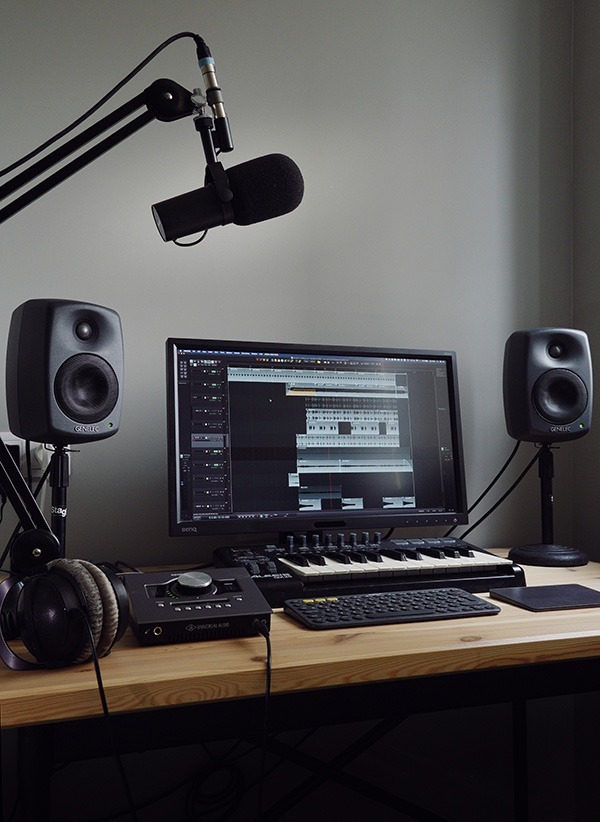
This screenshot has height=822, width=600. In order to click on keyboard in this screenshot , I will do `click(408, 606)`, `click(423, 556)`.